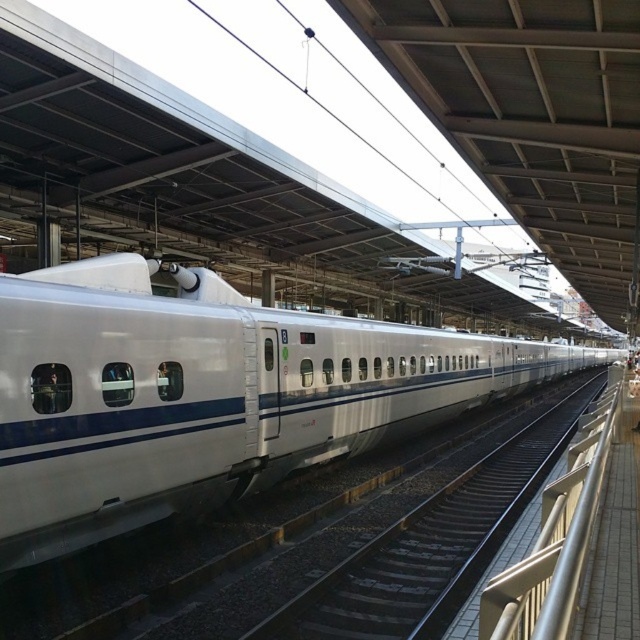
Question: Which point is farther to the camera?

Choices:
 (A) (x=556, y=486)
 (B) (x=48, y=506)
 (C) (x=307, y=593)

Answer: (C)

Question: Can you confirm if white smooth train track at center is positioned above silver metallic rail at right?

Choices:
 (A) no
 (B) yes

Answer: (A)

Question: Can you confirm if white glossy train at center is wider than silver metallic rail at right?

Choices:
 (A) yes
 (B) no

Answer: (A)

Question: Which of these objects is positioned farthest from the white glossy train at center?

Choices:
 (A) white smooth train track at center
 (B) silver metallic rail at right

Answer: (B)

Question: Does white glossy train at center appear over white smooth train track at center?

Choices:
 (A) yes
 (B) no

Answer: (A)

Question: Which of the following is the closest to the observer?

Choices:
 (A) (81, 397)
 (B) (420, 504)
 (C) (556, 570)

Answer: (C)